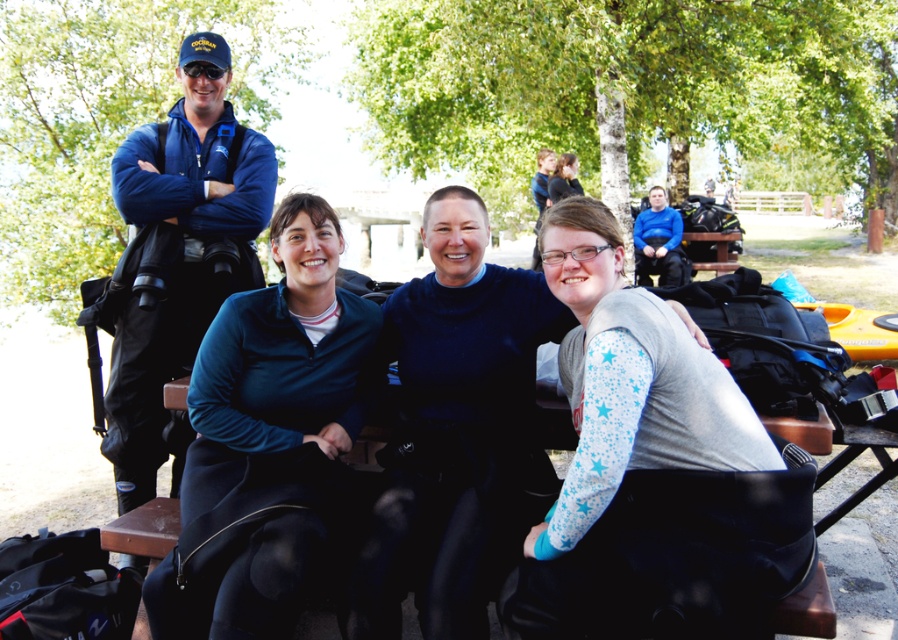
Which is more to the right, blue fleece jacket at center or matte black jacket at upper center?

matte black jacket at upper center

Is point (314, 324) positioned in front of point (564, 157)?

Yes, it is in front of point (564, 157).

At what (x,y) coordinates should I click in order to perform the action: click on blue fleece jacket at center. Please return your answer as a coordinate pair (x, y). Image resolution: width=898 pixels, height=640 pixels. Looking at the image, I should click on (266, 435).

Can you confirm if blue fleece jacket at center is positioned to the left of white matte shirt at center?

Indeed, blue fleece jacket at center is positioned on the left side of white matte shirt at center.

Does blue fleece jacket at center have a lesser width compared to white matte shirt at center?

Yes, blue fleece jacket at center is thinner than white matte shirt at center.

I want to click on blue fleece jacket at center, so click(266, 435).

In order to click on blue fleece jacket at center in this screenshot , I will do `click(266, 435)`.

Can you confirm if white matte shirt at center is thinner than matte black jacket at upper center?

No.

Is point (681, 372) positioned in front of point (561, 184)?

Yes.

What do you see at coordinates (618, 422) in the screenshot? I see `white matte shirt at center` at bounding box center [618, 422].

Identify the location of white matte shirt at center. This screenshot has height=640, width=898. (618, 422).